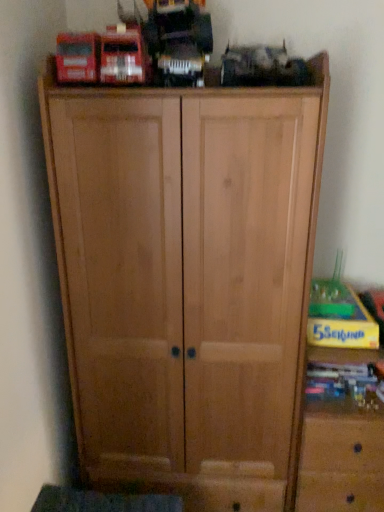
Question: Should I look upward or downward to see wooden side cabinet at right?

Choices:
 (A) down
 (B) up

Answer: (A)